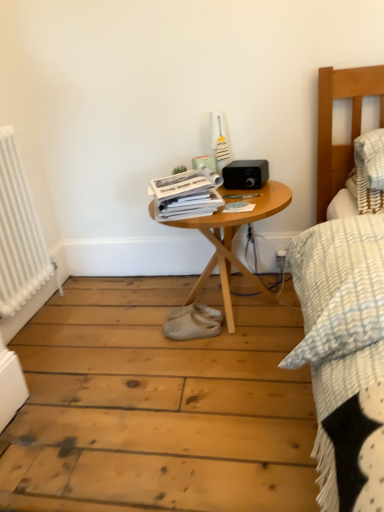
Question: Is white plastic electric outlet at lower right oriented towards matte paper magazine at center, which ranks as the 2th magazine in left-to-right order?

Choices:
 (A) no
 (B) yes

Answer: (A)

Question: Is white plastic electric outlet at lower right in front of matte paper magazine at center, which is counted as the 1th magazine, starting from the right?

Choices:
 (A) yes
 (B) no

Answer: (B)

Question: Considering the relative positions of white plastic electric outlet at lower right and matte paper magazine at center, which is counted as the 1th magazine, starting from the right, in the image provided, is white plastic electric outlet at lower right to the left of matte paper magazine at center, which is counted as the 1th magazine, starting from the right, from the viewer's perspective?

Choices:
 (A) yes
 (B) no

Answer: (B)

Question: Is white plastic electric outlet at lower right looking in the opposite direction of matte paper magazine at center, which is counted as the 1th magazine, starting from the right?

Choices:
 (A) no
 (B) yes

Answer: (A)

Question: Does white plastic electric outlet at lower right come behind matte paper magazine at center, which is counted as the 1th magazine, starting from the right?

Choices:
 (A) no
 (B) yes

Answer: (B)

Question: From the image's perspective, is white suede shoe at center above or below white metallic radiator at left?

Choices:
 (A) above
 (B) below

Answer: (B)

Question: Looking at their shapes, would you say white suede shoe at center is wider or thinner than white metallic radiator at left?

Choices:
 (A) wide
 (B) thin

Answer: (A)

Question: Considering the positions of white suede shoe at center and white metallic radiator at left in the image, is white suede shoe at center bigger or smaller than white metallic radiator at left?

Choices:
 (A) small
 (B) big

Answer: (A)

Question: In the image, is white suede shoe at center on the left side or the right side of white metallic radiator at left?

Choices:
 (A) left
 (B) right

Answer: (B)

Question: In terms of width, does white metallic radiator at left look wider or thinner when compared to matte paper magazine at center, which is counted as the 1th magazine, starting from the right?

Choices:
 (A) thin
 (B) wide

Answer: (A)

Question: From the image's perspective, relative to matte paper magazine at center, which is counted as the 1th magazine, starting from the right, is white metallic radiator at left above or below?

Choices:
 (A) below
 (B) above

Answer: (A)

Question: Is white metallic radiator at left bigger or smaller than matte paper magazine at center, which ranks as the 2th magazine in left-to-right order?

Choices:
 (A) big
 (B) small

Answer: (A)

Question: Does point (41, 271) appear closer or farther from the camera than point (223, 208)?

Choices:
 (A) farther
 (B) closer

Answer: (A)

Question: Which is correct: white glossy magazine at center, which ranks as the second magazine in right-to-left order, is inside white suede shoe at center, or outside of it?

Choices:
 (A) inside
 (B) outside

Answer: (B)

Question: From the image's perspective, is white glossy magazine at center, arranged as the first magazine when viewed from the left, positioned above or below white suede shoe at center?

Choices:
 (A) below
 (B) above

Answer: (B)